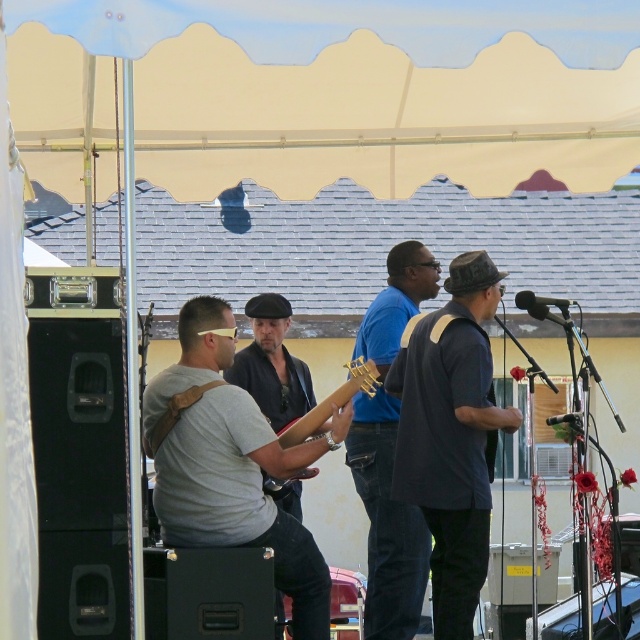
You are a photographer positioned at the back of the tent. You want to take a photo of both the dark blue shirt at center and the matte brown guitar at center. Which object will appear closer to the front in your photo?

The dark blue shirt at center will appear closer to the front in the photo because it is positioned further to the viewer than the matte brown guitar at center.

You are a stagehand who needs to move a 50 cm wide equipment box between the dark blue shirt at center and the blue matte guitar at center. Can the equipment box fit through the space between them?

The space between dark blue shirt at center and blue matte guitar at center is 58.37 centimeters. Since the equipment box is 50 cm wide, it can fit through the space between them as 50 cm is less than 58.37 cm.

You are a stagehand who needs to move a 40 cm wide amplifier between the wooden acoustic guitar at center and the matte brown guitar at center. Can the amplifier fit between them without touching either guitar?

The distance between the wooden acoustic guitar at center and the matte brown guitar at center is 50.38 centimeters. Since the amplifier is 40 cm wide, it can fit between them as there is enough space.